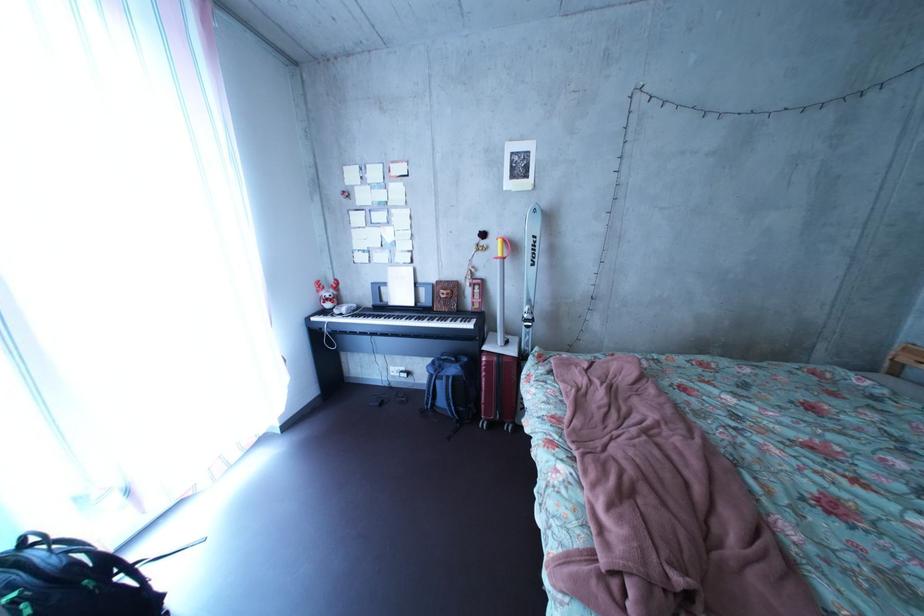
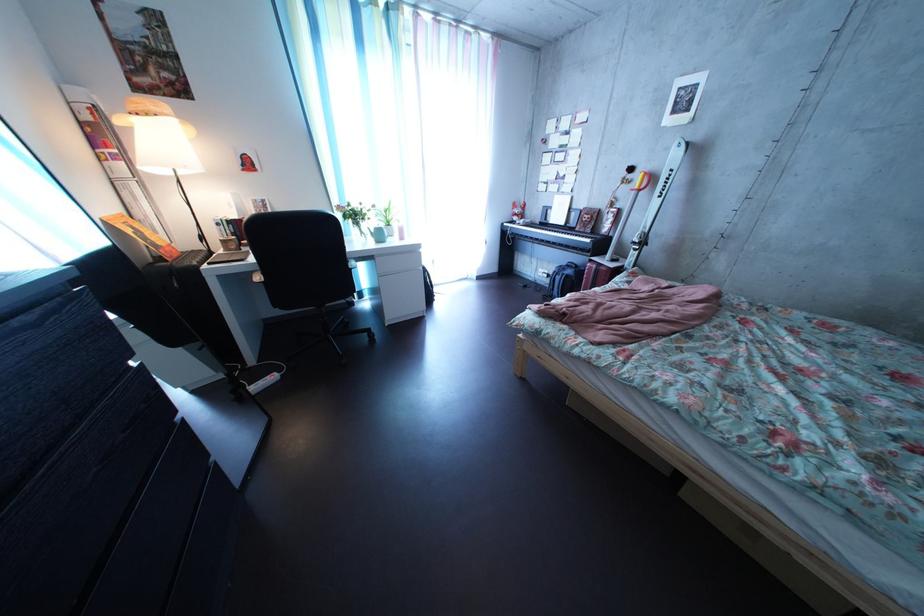
Find the pixel in the second image that matches (x=427, y=313) in the first image.

(577, 232)